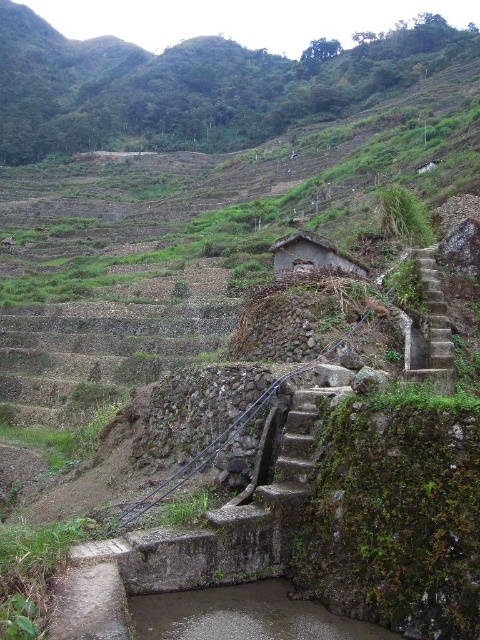
Question: Is green mossy stone stairs at right wider than rustic stone hut at center?

Choices:
 (A) no
 (B) yes

Answer: (A)

Question: Which object is farther from the camera taking this photo?

Choices:
 (A) green mossy stone stairs at right
 (B) rustic stone hut at center

Answer: (B)

Question: Among these objects, which one is nearest to the camera?

Choices:
 (A) green mossy stone stairs at right
 (B) rustic stone hut at center

Answer: (A)

Question: Among these objects, which one is nearest to the camera?

Choices:
 (A) rustic stone hut at center
 (B) green mossy stone stairs at right

Answer: (B)

Question: Does green mossy stone stairs at right have a smaller size compared to rustic stone hut at center?

Choices:
 (A) no
 (B) yes

Answer: (B)

Question: Does green mossy stone stairs at right come in front of rustic stone hut at center?

Choices:
 (A) yes
 (B) no

Answer: (A)